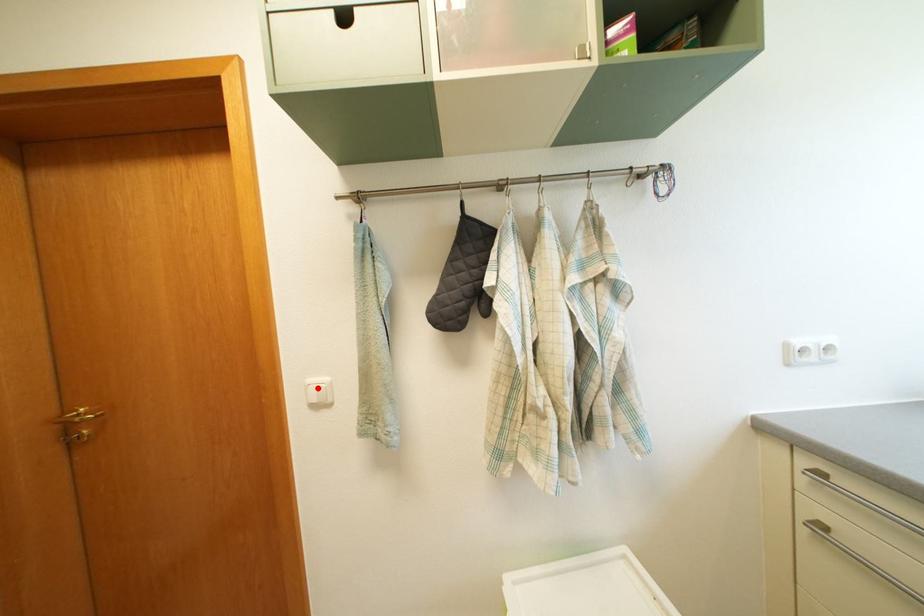
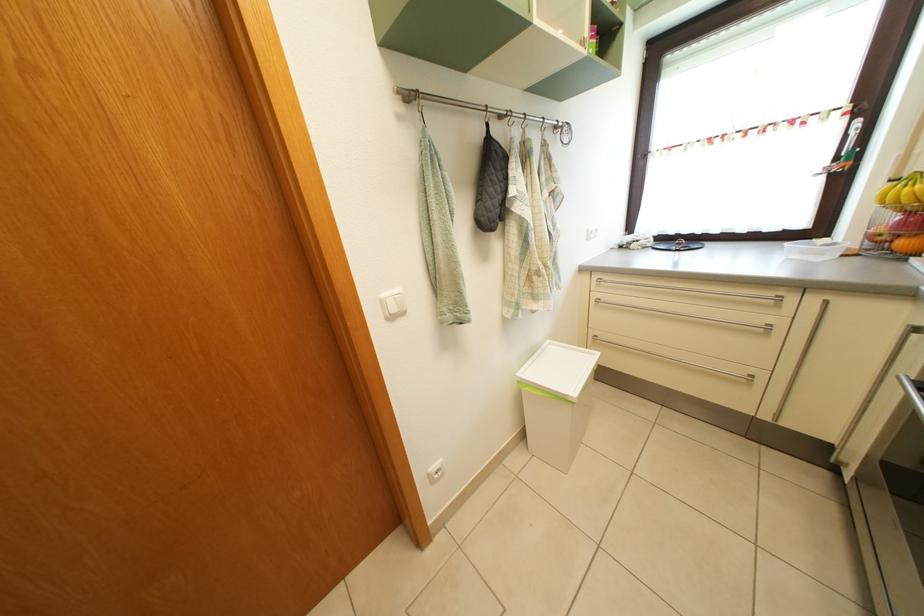
Question: I am providing you with two images of the same scene from different viewpoints. Image1 has a red point marked. In image2, the corresponding 3D location appears at what relative position? Reply with the corresponding letter.

Choices:
 (A) Closer
 (B) Farther

Answer: (A)